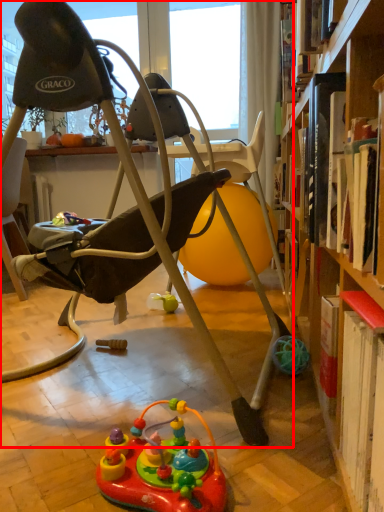
Question: From the image's perspective, where is chair (annotated by the red box) located in relation to toy in the image?

Choices:
 (A) below
 (B) above

Answer: (B)